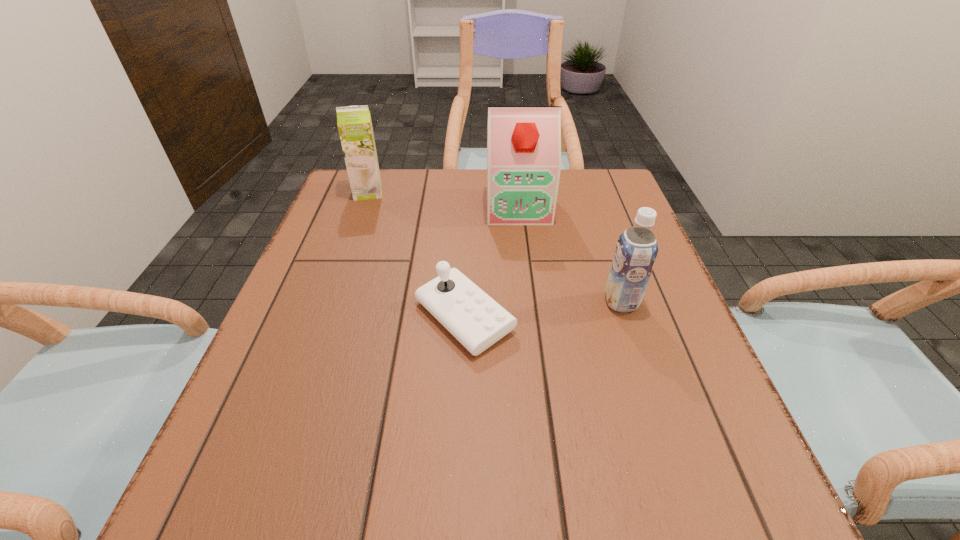
You are a GUI agent. You are given a task and a screenshot of the screen. Output one action in this format:
    pyautogui.click(x=<x>, y=<y>)
    Task: Click on the free space located on the back of the joystick
    The image size is (960, 540).
    Given the screenshot: What is the action you would take?
    pyautogui.click(x=468, y=241)

What are the coordinates of `object at the left edge` in the screenshot? It's located at (354, 123).

The width and height of the screenshot is (960, 540). I want to click on object at the right edge, so click(636, 250).

Locate an element on the screen. The width and height of the screenshot is (960, 540). object that is at the far left corner is located at coordinates (354, 123).

This screenshot has width=960, height=540. I want to click on free space at the far edge of the desktop, so click(428, 187).

This screenshot has width=960, height=540. In the image, there is a desktop. In order to click on vacant region at the near edge in this screenshot , I will do `click(530, 501)`.

In the image, there is a desktop. Where is `free region at the left edge`? free region at the left edge is located at coordinates (341, 290).

Image resolution: width=960 pixels, height=540 pixels. I want to click on vacant area at the right edge, so click(582, 221).

Locate an element on the screen. This screenshot has height=540, width=960. vacant space at the far left corner is located at coordinates (395, 184).

Where is `vacant area at the far right corner`? vacant area at the far right corner is located at coordinates (620, 214).